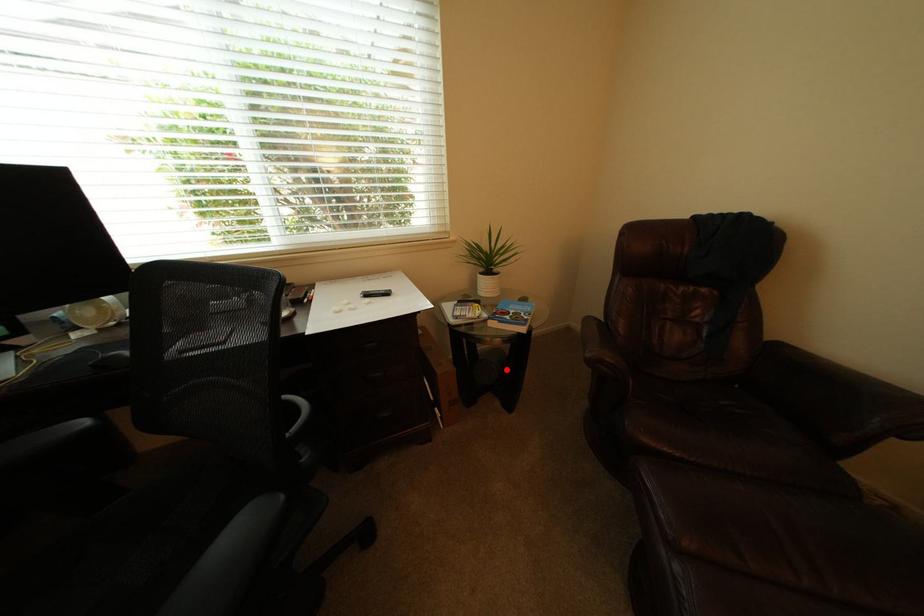
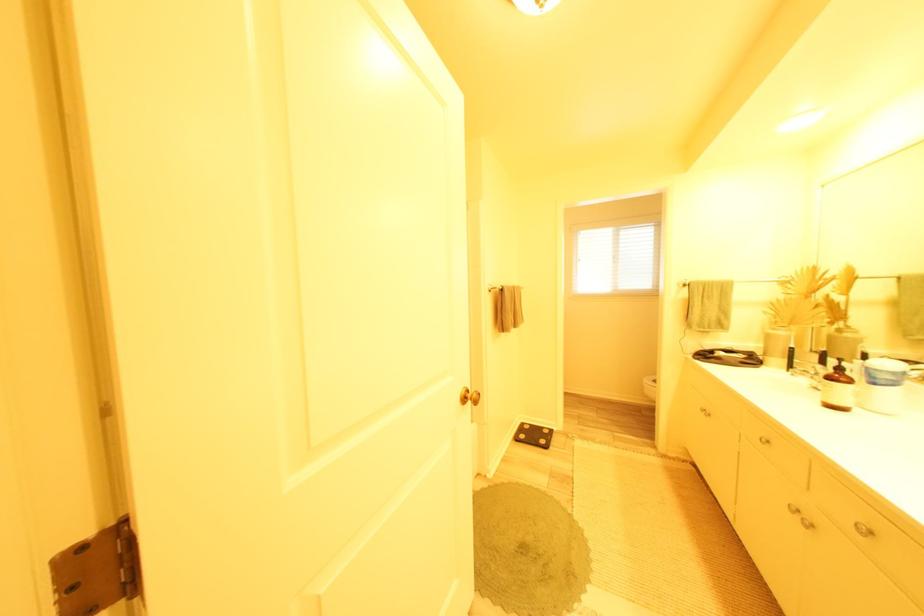
Question: I am providing you with two images of the same scene from different viewpoints. A red point is marked on the first image. Is the red point's position out of view in image 2?

Choices:
 (A) Yes
 (B) No

Answer: (A)